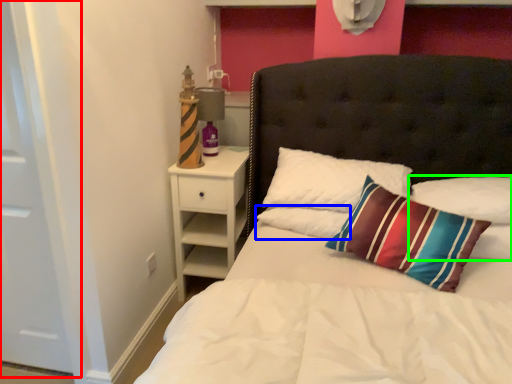
Question: Which is nearer to the door (highlighted by a red box)? pillow (highlighted by a blue box) or pillow (highlighted by a green box).

Choices:
 (A) pillow
 (B) pillow

Answer: (A)